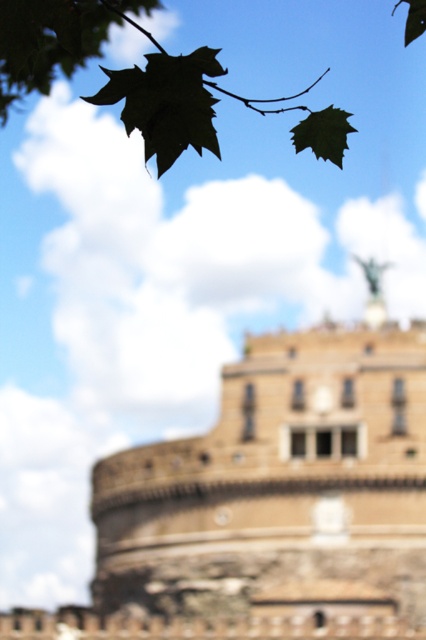
Question: Among these points, which one is farthest from the camera?

Choices:
 (A) (175, 605)
 (B) (313, 140)
 (C) (43, 49)

Answer: (A)

Question: Which object appears farthest from the camera in this image?

Choices:
 (A) green leafy branch at upper left
 (B) green matte leaf at upper left
 (C) brown stone castle at center
 (D) green matte leaf at upper center

Answer: (C)

Question: Where is brown stone castle at center located in relation to green leafy branch at upper left in the image?

Choices:
 (A) right
 (B) left

Answer: (B)

Question: Which point is closer to the camera?

Choices:
 (A) (403, 483)
 (B) (307, 145)
 (C) (49, 42)

Answer: (B)

Question: Is green leafy branch at upper left bigger than green matte leaf at upper left?

Choices:
 (A) yes
 (B) no

Answer: (A)

Question: Does green leafy branch at upper left have a smaller size compared to green matte leaf at upper center?

Choices:
 (A) yes
 (B) no

Answer: (B)